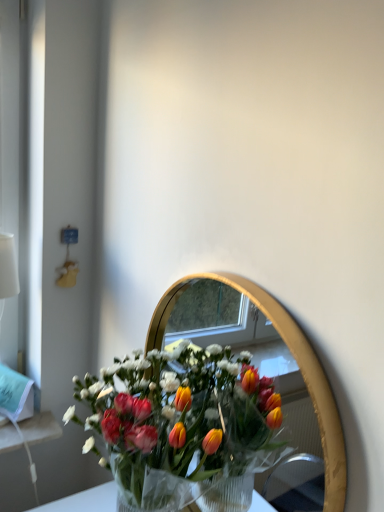
Identify the location of vacant space situated above gold metallic mirror at center (from a real-world perspective). (237, 268).